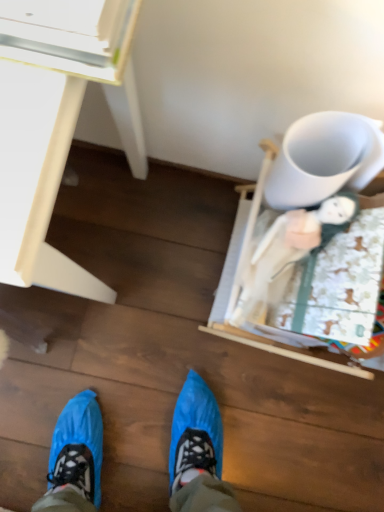
Question: From the image's perspective, is white glossy desk at upper left located beneath white matte mug at upper right?

Choices:
 (A) yes
 (B) no

Answer: (A)

Question: Can you confirm if white glossy desk at upper left is wider than white matte mug at upper right?

Choices:
 (A) yes
 (B) no

Answer: (A)

Question: Can you confirm if white glossy desk at upper left is taller than white matte mug at upper right?

Choices:
 (A) yes
 (B) no

Answer: (A)

Question: From the image's perspective, would you say white glossy desk at upper left is positioned over white matte mug at upper right?

Choices:
 (A) yes
 (B) no

Answer: (B)

Question: Is white glossy desk at upper left closer to the viewer compared to white matte mug at upper right?

Choices:
 (A) no
 (B) yes

Answer: (B)

Question: Is white glossy desk at upper left smaller than white matte mug at upper right?

Choices:
 (A) no
 (B) yes

Answer: (A)

Question: Does white matte mug at upper right have a lesser height compared to white glossy desk at upper left?

Choices:
 (A) yes
 (B) no

Answer: (A)

Question: Is white matte mug at upper right to the left of white glossy desk at upper left from the viewer's perspective?

Choices:
 (A) yes
 (B) no

Answer: (B)

Question: From the image's perspective, is white matte mug at upper right under white glossy desk at upper left?

Choices:
 (A) yes
 (B) no

Answer: (B)

Question: Is white matte mug at upper right positioned before white glossy desk at upper left?

Choices:
 (A) yes
 (B) no

Answer: (B)

Question: Does white matte mug at upper right have a lesser width compared to white glossy desk at upper left?

Choices:
 (A) no
 (B) yes

Answer: (B)

Question: Is white matte mug at upper right at the right side of white glossy desk at upper left?

Choices:
 (A) no
 (B) yes

Answer: (B)

Question: From the image's perspective, is white matte mug at upper right positioned above or below white glossy desk at upper left?

Choices:
 (A) above
 (B) below

Answer: (A)